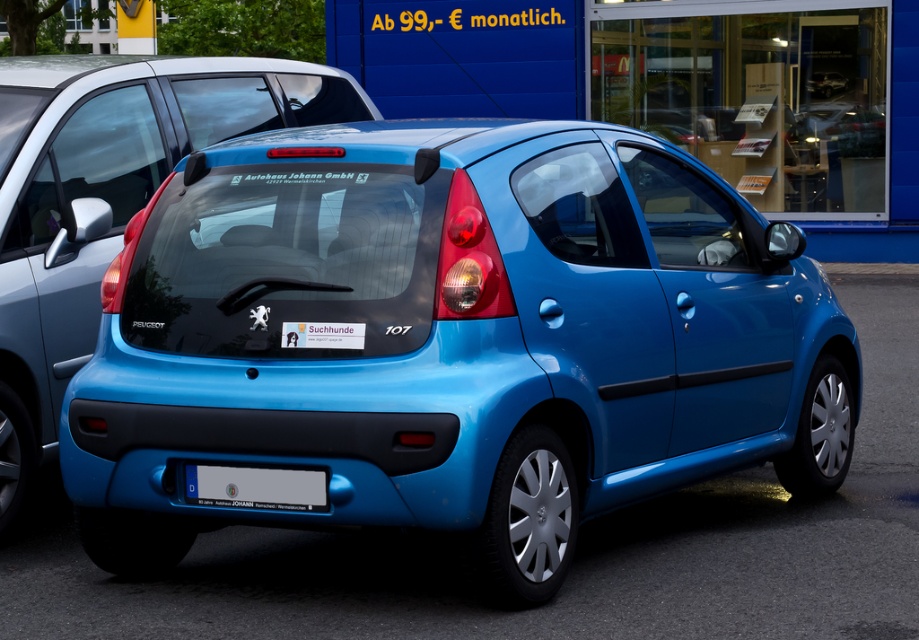
The image size is (919, 640). Describe the element at coordinates (452, 340) in the screenshot. I see `matte blue car at center` at that location.

Is point (165, 372) positioned behind point (33, 321)?

No, it is not.

Find the location of `matte blue car at center`. matte blue car at center is located at coordinates (452, 340).

Can you confirm if matte black minivan at left is bigger than white plastic license plate at center?

Indeed, matte black minivan at left has a larger size compared to white plastic license plate at center.

Is matte black minivan at left below white plastic license plate at center?

No.

I want to click on matte black minivan at left, so click(x=105, y=200).

I want to click on matte black minivan at left, so click(105, 200).

Is matte blue car at center above white plastic license plate at center?

Yes.

Does point (358, 401) come in front of point (296, 509)?

That is True.

Image resolution: width=919 pixels, height=640 pixels. Identify the location of matte blue car at center. (452, 340).